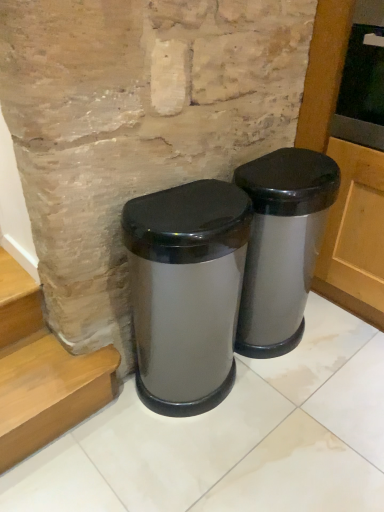
Question: Would you say satin silver trash can at center, which is the 1th waste container in left-to-right order, is inside or outside satin silver trash can at center, the 1th waste container positioned from the right?

Choices:
 (A) outside
 (B) inside

Answer: (A)

Question: Is satin silver trash can at center, which is the 1th waste container in left-to-right order, wider or thinner than satin silver trash can at center, which is the 2th waste container in left-to-right order?

Choices:
 (A) wide
 (B) thin

Answer: (A)

Question: Is point (168, 249) positioned closer to the camera than point (274, 194)?

Choices:
 (A) closer
 (B) farther

Answer: (A)

Question: Looking at their shapes, would you say satin silver trash can at center, which is the 2th waste container in left-to-right order, is wider or thinner than satin silver trash can at center, which is the 1th waste container in left-to-right order?

Choices:
 (A) thin
 (B) wide

Answer: (A)

Question: In the image, is satin silver trash can at center, the 1th waste container positioned from the right, positioned in front of or behind satin silver trash can at center, arranged as the second waste container when viewed from the right?

Choices:
 (A) behind
 (B) front

Answer: (A)

Question: Is point (271, 161) closer or farther from the camera than point (200, 287)?

Choices:
 (A) closer
 (B) farther

Answer: (B)

Question: Is satin silver trash can at center, which is the 2th waste container in left-to-right order, situated inside satin silver trash can at center, which is the 1th waste container in left-to-right order, or outside?

Choices:
 (A) outside
 (B) inside

Answer: (A)